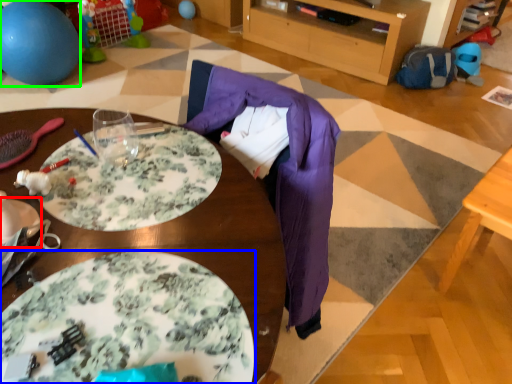
Question: Which object is positioned farthest from plate (highlighted by a red box)? Select from plate (highlighted by a blue box) and ball (highlighted by a green box).

Choices:
 (A) plate
 (B) ball

Answer: (B)